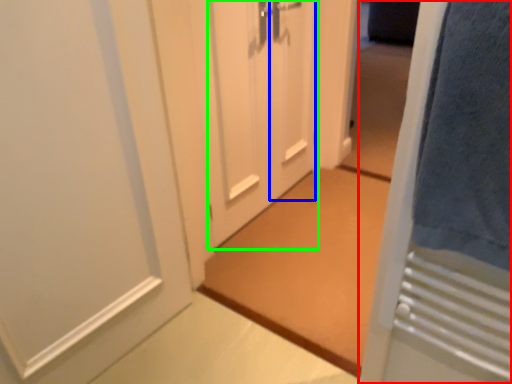
Question: Which object is positioned farthest from door (highlighted by a red box)? Select from door (highlighted by a blue box) and door (highlighted by a green box).

Choices:
 (A) door
 (B) door

Answer: (A)